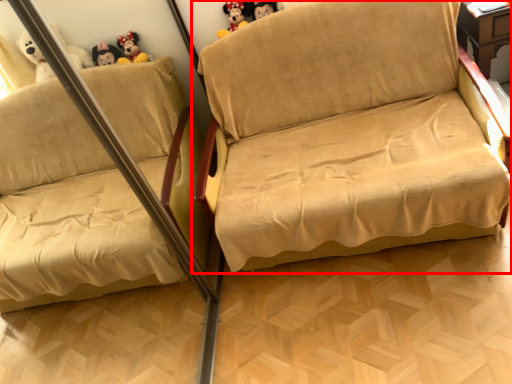
Question: From the image's perspective, what is the correct spatial relationship of studio couch (annotated by the red box) in relation to toy?

Choices:
 (A) below
 (B) above

Answer: (A)